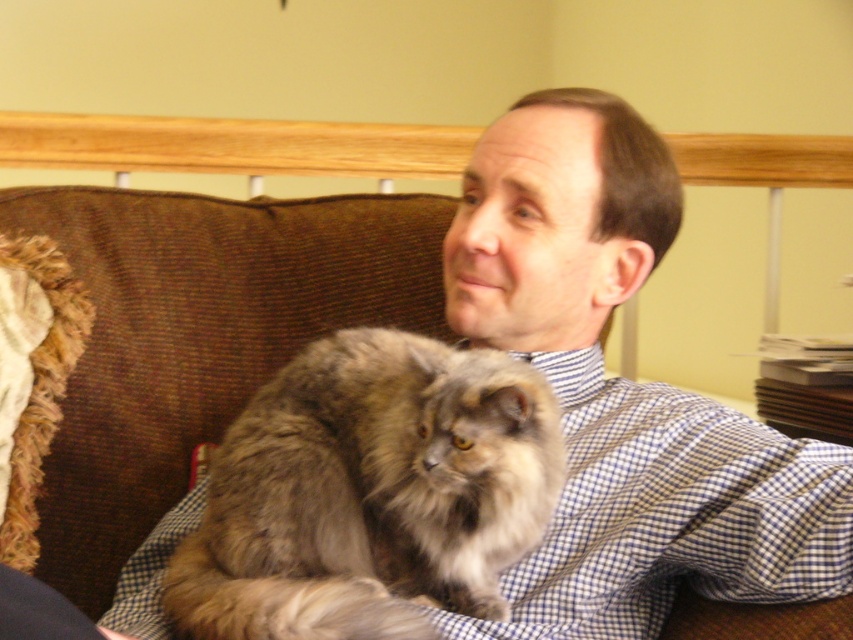
Question: Is brown corduroy couch at upper left bigger than fuzzy brown cat at center?

Choices:
 (A) no
 (B) yes

Answer: (B)

Question: Among these points, which one is farthest from the camera?

Choices:
 (A) (114, 218)
 (B) (413, 403)

Answer: (A)

Question: Does brown corduroy couch at upper left come behind fuzzy brown cat at center?

Choices:
 (A) no
 (B) yes

Answer: (B)

Question: Is brown corduroy couch at upper left above fuzzy brown cat at center?

Choices:
 (A) no
 (B) yes

Answer: (B)